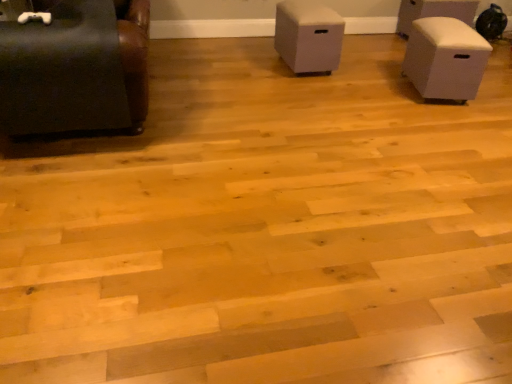
Question: Is white fabric ottoman at upper right, which is counted as the 4th furniture, starting from the left, spatially inside white matte storage box at center, acting as the third furniture starting from the right, or outside of it?

Choices:
 (A) outside
 (B) inside

Answer: (A)

Question: Considering the positions of white fabric ottoman at upper right, arranged as the first furniture when viewed from the back, and white matte storage box at center, acting as the third furniture starting from the right, in the image, is white fabric ottoman at upper right, arranged as the first furniture when viewed from the back, bigger or smaller than white matte storage box at center, acting as the third furniture starting from the right,?

Choices:
 (A) small
 (B) big

Answer: (A)

Question: Which of these objects is positioned closest to the white matte storage box at center, which is counted as the 2th furniture, starting from the left?

Choices:
 (A) beige matte storage box at right, the third furniture viewed from the back
 (B) white fabric ottoman at upper right, positioned as the 1th furniture in right-to-left order
 (C) matte black couch at left, marked as the first furniture in a left-to-right arrangement

Answer: (A)

Question: Which object is positioned farthest from the matte black couch at left, the fourth furniture positioned from the back?

Choices:
 (A) white fabric ottoman at upper right, marked as the 4th furniture in a front-to-back arrangement
 (B) white matte storage box at center, acting as the third furniture starting from the right
 (C) beige matte storage box at right, the third furniture viewed from the back

Answer: (A)